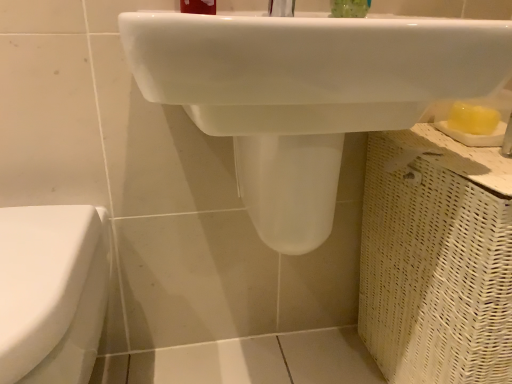
Question: From a real-world perspective, relative to matte plastic toothbrush at upper center, is white glossy sink at upper center vertically above or below?

Choices:
 (A) above
 (B) below

Answer: (B)

Question: Looking at the image, does white glossy sink at upper center seem bigger or smaller compared to matte plastic toothbrush at upper center?

Choices:
 (A) small
 (B) big

Answer: (B)

Question: Based on their relative distances, which object is nearer to the white glossy sink at upper center?

Choices:
 (A) white glossy toilet at left
 (B) matte plastic toothbrush at upper center
 (C) green translucent soap at upper center

Answer: (A)

Question: Which object is the closest to the green translucent soap at upper center?

Choices:
 (A) white glossy toilet at left
 (B) matte plastic toothbrush at upper center
 (C) white glossy sink at upper center

Answer: (B)